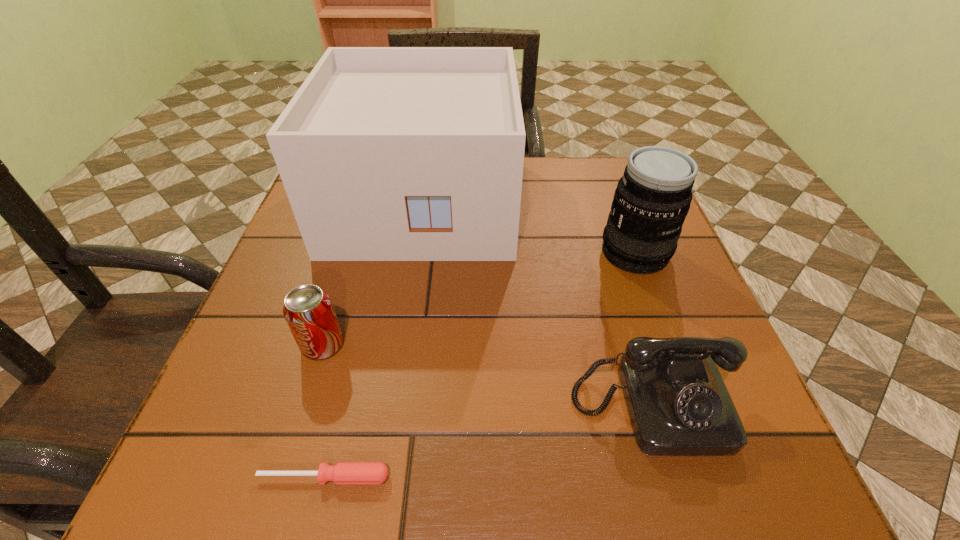
This screenshot has height=540, width=960. I want to click on object present at the near right corner, so click(678, 404).

Locate an element on the screen. Image resolution: width=960 pixels, height=540 pixels. free location at the far edge is located at coordinates 536,185.

You are a GUI agent. You are given a task and a screenshot of the screen. Output one action in this format:
    pyautogui.click(x=<x>, y=<y>)
    Task: Click on the vacant space at the left edge of the desktop
    
    Given the screenshot: What is the action you would take?
    pyautogui.click(x=300, y=254)

You are a GUI agent. You are given a task and a screenshot of the screen. Output one action in this format:
    pyautogui.click(x=<x>, y=<y>)
    Task: Click on the vacant area at the right edge of the desktop
    
    Given the screenshot: What is the action you would take?
    pyautogui.click(x=598, y=240)

Locate an element on the screen. free space at the far right corner is located at coordinates (623, 164).

Locate an element on the screen. This screenshot has height=540, width=960. free space at the near right corner is located at coordinates (732, 482).

Identify the location of empty space that is in between the box and the shortest object. This screenshot has width=960, height=540. (373, 339).

Locate an element on the screen. free space between the fourth shortest object and the soda can is located at coordinates (479, 299).

What are the coordinates of `vacant region between the tallest object and the telephone` in the screenshot? It's located at (538, 303).

At what (x,y) coordinates should I click in order to perform the action: click on vacant space that's between the second tallest object and the shortest object. Please return your answer as a coordinate pair (x, y). The height and width of the screenshot is (540, 960). Looking at the image, I should click on (480, 365).